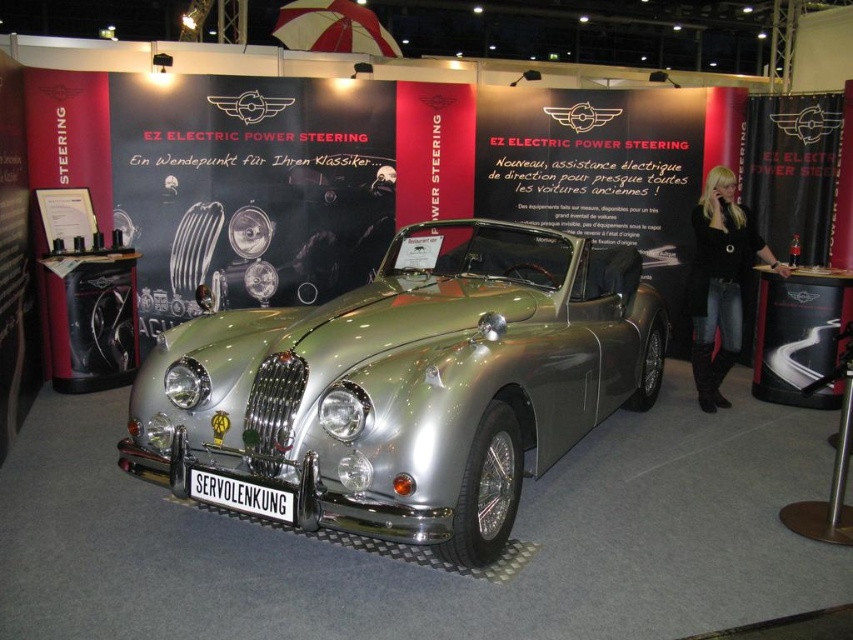
You are at an exhibition and want to take a photo of both the silver metallic car at center and the black metal sign at center. Since you can only focus on one object at a time, which one should you position closer to the camera to ensure both are in focus?

Since the silver metallic car at center is to the right of the black metal sign at center, you should position the black metal sign at center closer to the camera. This way, both objects will be within the depth of field and in focus.

You are a photographer at the exhibition. You need to capture a photo of the silver metallic car at center and the black metal sign at center. The camera you have can only focus on objects within a 2.5 meter width. Can both objects fit in the frame if they are placed side by side?

The silver metallic car at center is wider than the black metal sign at center. Since the camera can only focus on objects within a 2.5 meter width, it depends on the combined width of both objects. However, the description only states the car is wider than the sign but does not provide exact measurements. Without knowing the exact widths, it is impossible to determine if they can fit together within the 2.5 meter limit.